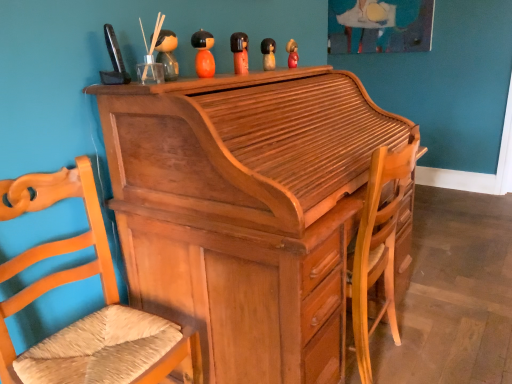
Question: Does matte orange doll at upper center, the 3th toy when ordered from back to front, have a greater height compared to light brown wood desk at center?

Choices:
 (A) yes
 (B) no

Answer: (B)

Question: Is the depth of matte orange doll at upper center, placed as the 3th toy when sorted from right to left, greater than that of light brown wood desk at center?

Choices:
 (A) yes
 (B) no

Answer: (A)

Question: Are matte orange doll at upper center, marked as the 3th toy in a front-to-back arrangement, and light brown wood desk at center making contact?

Choices:
 (A) no
 (B) yes

Answer: (A)

Question: Considering the relative positions of matte orange doll at upper center, positioned as the third toy in left-to-right order, and light brown wood desk at center in the image provided, is matte orange doll at upper center, positioned as the third toy in left-to-right order, to the right of light brown wood desk at center from the viewer's perspective?

Choices:
 (A) yes
 (B) no

Answer: (B)

Question: Is matte orange doll at upper center, positioned as the third toy in left-to-right order, looking in the opposite direction of light brown wood desk at center?

Choices:
 (A) yes
 (B) no

Answer: (B)

Question: Considering the relative sizes of matte orange doll at upper center, placed as the 3th toy when sorted from right to left, and light brown wood desk at center in the image provided, is matte orange doll at upper center, placed as the 3th toy when sorted from right to left, smaller than light brown wood desk at center?

Choices:
 (A) no
 (B) yes

Answer: (B)

Question: Can you confirm if matte orange doll at upper center, positioned as the third toy in left-to-right order, is bigger than matte yellow doll at center, the 2th toy viewed from the back?

Choices:
 (A) yes
 (B) no

Answer: (A)

Question: Is matte orange doll at upper center, marked as the 3th toy in a front-to-back arrangement, oriented away from matte yellow doll at center, positioned as the 4th toy in front-to-back order?

Choices:
 (A) yes
 (B) no

Answer: (B)

Question: Are matte orange doll at upper center, positioned as the third toy in left-to-right order, and matte yellow doll at center, which is counted as the second toy, starting from the right, making contact?

Choices:
 (A) yes
 (B) no

Answer: (B)

Question: Can you confirm if matte orange doll at upper center, marked as the 3th toy in a front-to-back arrangement, is taller than matte yellow doll at center, the 2th toy viewed from the back?

Choices:
 (A) yes
 (B) no

Answer: (A)

Question: Does matte orange doll at upper center, placed as the 3th toy when sorted from right to left, turn towards matte yellow doll at center, which is counted as the second toy, starting from the right?

Choices:
 (A) no
 (B) yes

Answer: (A)

Question: Is matte orange doll at upper center, the 3th toy when ordered from back to front, at the right side of matte yellow doll at center, the fourth toy viewed from the left?

Choices:
 (A) no
 (B) yes

Answer: (A)

Question: From a real-world perspective, is orange matte wooden doll at upper center, which is the 2th toy in front-to-back order, physically above matte orange doll at upper center, marked as the 3th toy in a front-to-back arrangement?

Choices:
 (A) yes
 (B) no

Answer: (A)